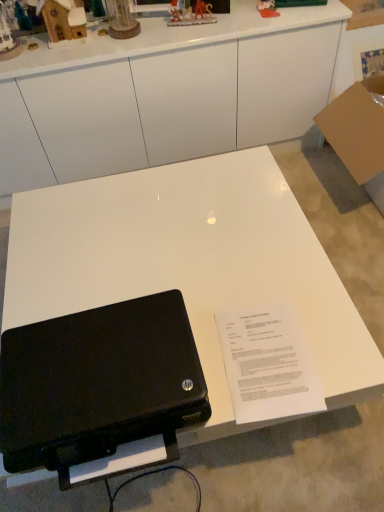
Question: Is wooden house at upper left, which is counted as the second toy, starting from the left, taller or shorter than white glossy table at center?

Choices:
 (A) tall
 (B) short

Answer: (B)

Question: From the image's perspective, relative to white glossy table at center, is wooden house at upper left, which is counted as the second toy, starting from the left, above or below?

Choices:
 (A) below
 (B) above

Answer: (B)

Question: Which is farther from the wooden house at upper left, which is counted as the second toy, starting from the left?

Choices:
 (A) brown cardboard at right
 (B) white paper at center
 (C) white glossy table at center
 (D) black matte laptop at lower left
 (E) white glossy desk at center

Answer: (B)

Question: Estimate the real-world distances between objects in this image. Which object is farther from the matte wooden clock at upper center, the third toy when ordered from left to right?

Choices:
 (A) wooden house at upper left, the fourth toy in the right-to-left sequence
 (B) wooden house at upper left, which ranks as the first toy in left-to-right order
 (C) white glossy table at center
 (D) plastic toy at upper center, which is the 5th toy in left-to-right order
 (E) metallic silver sleigh at upper center, placed as the second toy when sorted from right to left

Answer: (C)